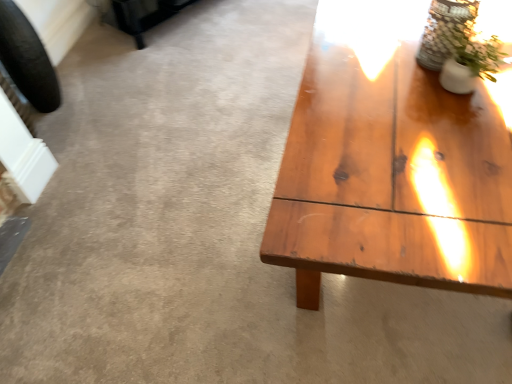
This screenshot has height=384, width=512. I want to click on clear glass vase at upper right, so click(443, 30).

Measure the distance between clear glass vase at upper right and camera.

1.11 meters.

In order to face black rubber tire at left, should I rotate leftwards or rightwards?

Turn left by 28.064 degrees to look at black rubber tire at left.

Find the location of a particular element. The image size is (512, 384). clear glass vase at upper right is located at coordinates (443, 30).

Find the location of `glass vase behind the white ceramic vase at upper right`. glass vase behind the white ceramic vase at upper right is located at coordinates (443, 30).

Does clear glass vase at upper right turn towards white ceramic vase at upper right?

No, clear glass vase at upper right is not facing towards white ceramic vase at upper right.

From a real-world perspective, does clear glass vase at upper right stand above white ceramic vase at upper right?

Indeed, from a real-world perspective, clear glass vase at upper right stands above white ceramic vase at upper right.

Which object is further away from the camera, clear glass vase at upper right or white ceramic vase at upper right?

clear glass vase at upper right is further from the camera.

Does clear glass vase at upper right appear on the left side of black rubber tire at left?

No.

I want to click on glass vase on the right of black rubber tire at left, so click(443, 30).

Does point (425, 48) come closer to viewer compared to point (24, 70)?

Yes, point (425, 48) is in front of point (24, 70).

Does point (465, 34) appear closer or farther from the camera than point (49, 58)?

Point (465, 34) appears to be closer to the viewer than point (49, 58).

Can you confirm if white ceramic vase at upper right is smaller than black rubber tire at left?

Indeed, white ceramic vase at upper right has a smaller size compared to black rubber tire at left.

Is black rubber tire at left a part of white ceramic vase at upper right?

That's incorrect, black rubber tire at left is not inside white ceramic vase at upper right.

Considering their positions, is white ceramic vase at upper right located in front of or behind black rubber tire at left?

white ceramic vase at upper right is positioned closer to the viewer than black rubber tire at left.

This screenshot has height=384, width=512. Identify the location of houseplant lying in front of the black rubber tire at left. (469, 59).

Looking at this image, from the image's perspective, which one is positioned lower, black rubber tire at left or white ceramic vase at upper right?

white ceramic vase at upper right is shown below in the image.

Which object is further away from the camera, black rubber tire at left or white ceramic vase at upper right?

black rubber tire at left is further from the camera.

Does black rubber tire at left have a smaller size compared to white ceramic vase at upper right?

Incorrect, black rubber tire at left is not smaller in size than white ceramic vase at upper right.

Is white ceramic vase at upper right positioned before clear glass vase at upper right?

Yes, it is.

From the image's perspective, who appears lower, white ceramic vase at upper right or clear glass vase at upper right?

white ceramic vase at upper right, from the image's perspective.

What are the coordinates of `glass vase positioned vertically above the white ceramic vase at upper right (from a real-world perspective)` in the screenshot? It's located at (443, 30).

Is white ceramic vase at upper right at the left side of clear glass vase at upper right?

No, white ceramic vase at upper right is not to the left of clear glass vase at upper right.

Is black rubber tire at left looking in the opposite direction of clear glass vase at upper right?

No, clear glass vase at upper right is not at the back of black rubber tire at left.

Can you tell me how much black rubber tire at left and clear glass vase at upper right differ in facing direction?

They differ by 180 degrees in their facing directions.

Considering the sizes of objects black rubber tire at left and clear glass vase at upper right in the image provided, who is bigger, black rubber tire at left or clear glass vase at upper right?

black rubber tire at left.

Is black rubber tire at left further to camera compared to clear glass vase at upper right?

Yes, black rubber tire at left is further from the camera.

You are a GUI agent. You are given a task and a screenshot of the screen. Output one action in this format:
    pyautogui.click(x=<x>, y=<y>)
    Task: Click on the houseplant that is on the right side of clear glass vase at upper right
    This screenshot has height=384, width=512.
    Given the screenshot: What is the action you would take?
    pyautogui.click(x=469, y=59)

Where is `car tire that appears below the clear glass vase at upper right (from a real-world perspective)`? Image resolution: width=512 pixels, height=384 pixels. car tire that appears below the clear glass vase at upper right (from a real-world perspective) is located at coordinates (27, 59).

From the image, which object appears to be nearer to white ceramic vase at upper right, clear glass vase at upper right or black rubber tire at left?

The object closer to white ceramic vase at upper right is clear glass vase at upper right.

Based on their spatial positions, is black rubber tire at left or clear glass vase at upper right further from white ceramic vase at upper right?

black rubber tire at left lies further to white ceramic vase at upper right than the other object.

Looking at the image, which one is located further to clear glass vase at upper right, black rubber tire at left or white ceramic vase at upper right?

black rubber tire at left.

Based on their spatial positions, is clear glass vase at upper right or white ceramic vase at upper right further from black rubber tire at left?

white ceramic vase at upper right is positioned further to the anchor black rubber tire at left.

From the image, which object appears to be farther from black rubber tire at left, white ceramic vase at upper right or clear glass vase at upper right?

The object further to black rubber tire at left is white ceramic vase at upper right.

When comparing their distances from clear glass vase at upper right, does white ceramic vase at upper right or black rubber tire at left seem closer?

white ceramic vase at upper right lies closer to clear glass vase at upper right than the other object.

The height and width of the screenshot is (384, 512). Identify the location of glass vase between black rubber tire at left and white ceramic vase at upper right from left to right. (443, 30).